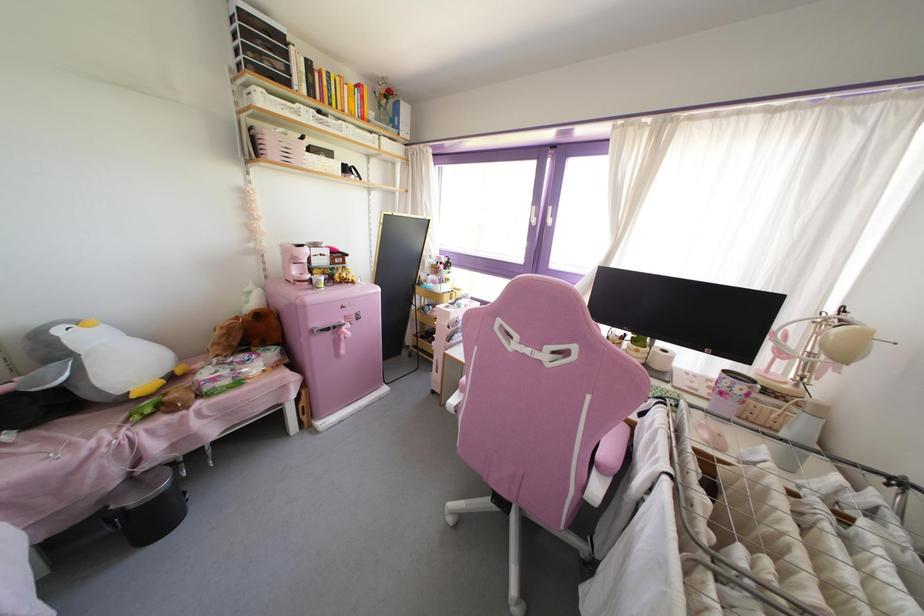
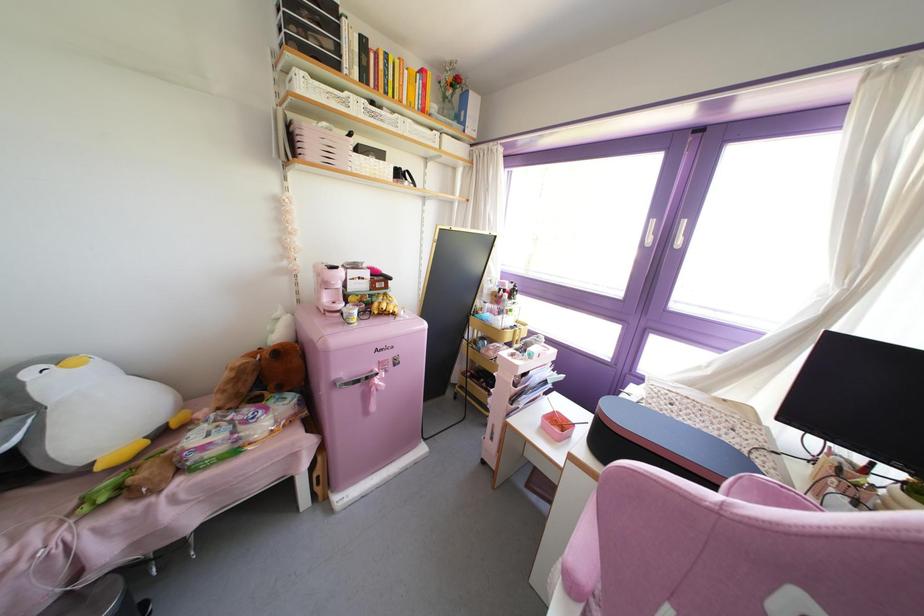
Question: The images are taken continuously from a first-person perspective. In which direction is your viewpoint rotating?

Choices:
 (A) Left
 (B) Right
 (C) Up
 (D) Down

Answer: (A)